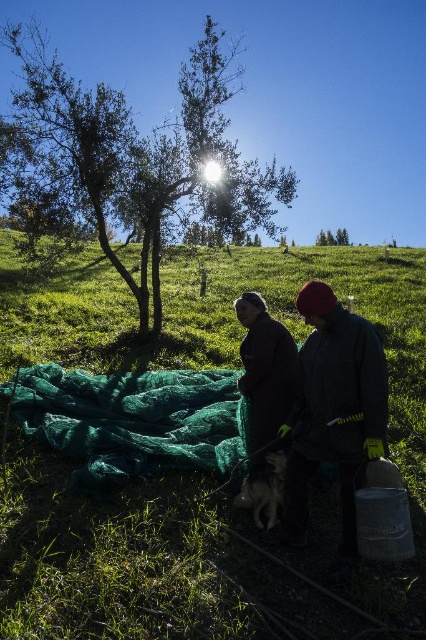
You are a GUI agent. You are given a task and a screenshot of the screen. Output one action in this format:
    pyautogui.click(x=<x>, y=<y>)
    Task: Click on the dark green fabric at center
    
    Given the screenshot: What is the action you would take?
    pyautogui.click(x=333, y=408)

In order to click on dark green fabric at center in this screenshot , I will do pyautogui.click(x=333, y=408).

Between point (311, 538) and point (337, 228), which one is positioned behind?

The point (337, 228) is more distant.

The width and height of the screenshot is (426, 640). Find the location of `green netting at center`. green netting at center is located at coordinates (175, 449).

Is green netting at center to the left of green leafy tree at upper center from the viewer's perspective?

In fact, green netting at center is to the right of green leafy tree at upper center.

Is point (83, 348) closer to camera compared to point (271, 172)?

That is True.

What are the coordinates of `green netting at center` in the screenshot? It's located at (175, 449).